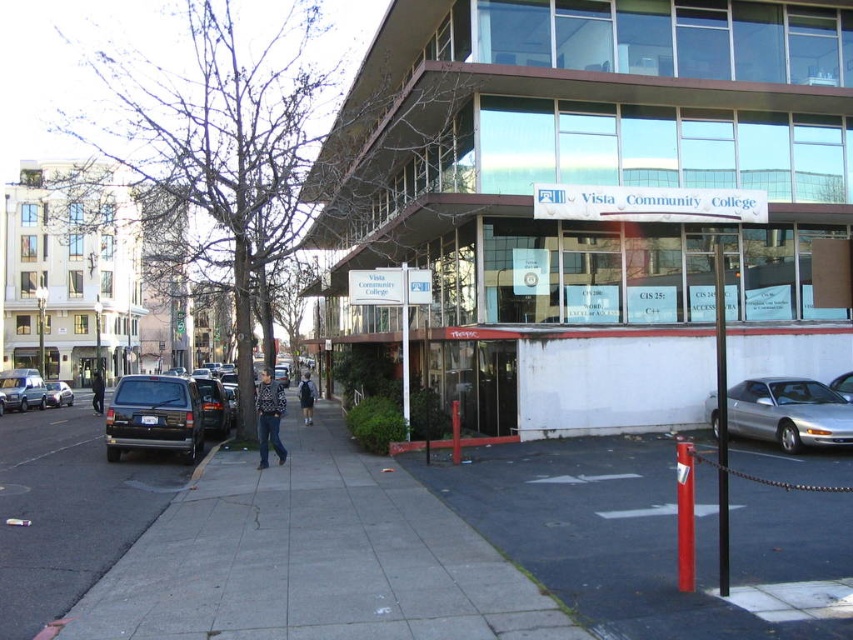
You are a delivery robot that needs to deliver a package to the entrance of Vista Community College. You have two paths to choose from the smooth asphalt pavement at lower center and the black asphalt at lower left. Which path is wider and safer for your delivery route?

The black asphalt at lower left is wider than the smooth asphalt pavement at lower center, so it is safer for the delivery robot to choose the black asphalt at lower left as its path.